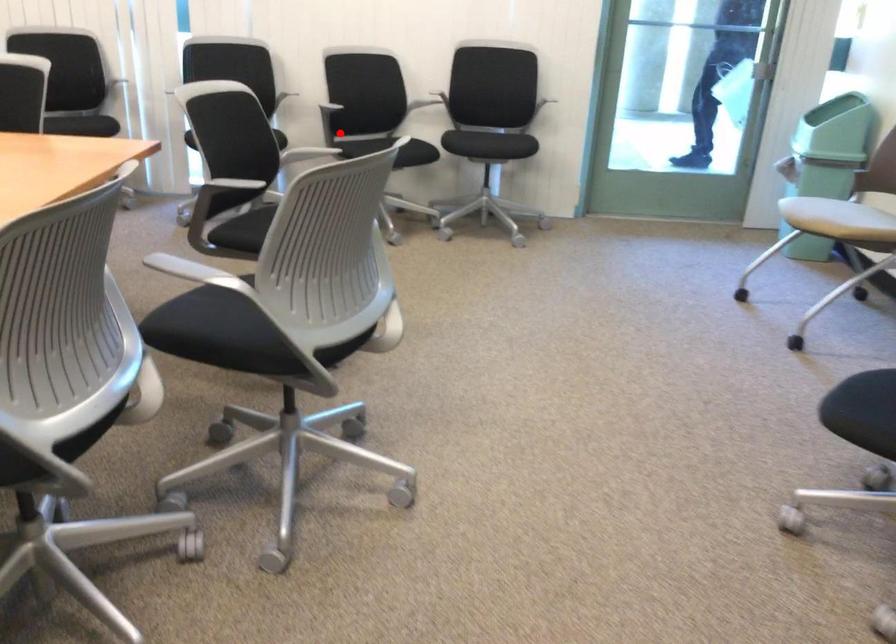
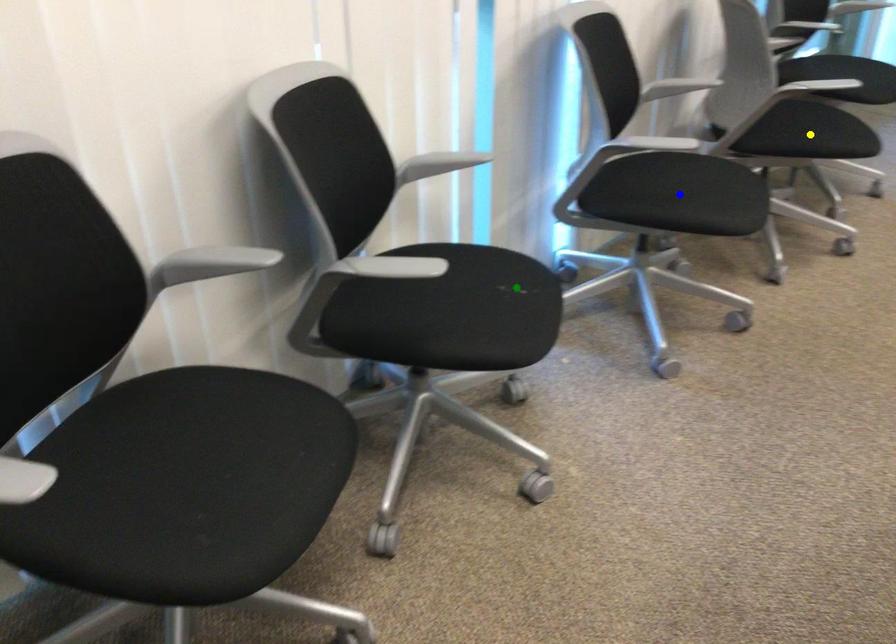
Question: I am providing you with two images of the same scene from different viewpoints. A red point is marked on the first image. You are given multiple points on the second image. Can you choose the point in image 2 that corresponds to the point in image 1?

Choices:
 (A) yellow point
 (B) blue point
 (C) green point

Answer: (A)